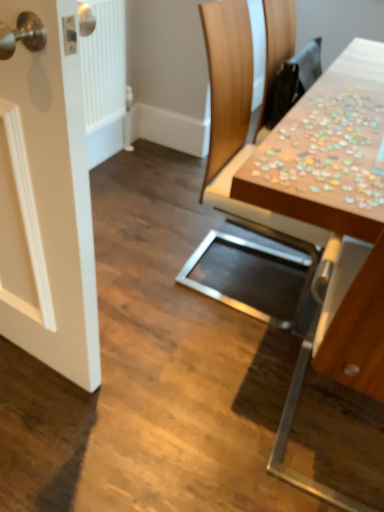
I want to click on vacant space underneath wooden puzzle pieces at upper right (from a real-world perspective), so (325, 457).